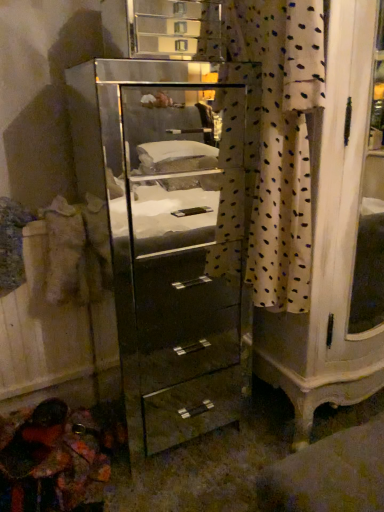
Question: Is mirror-finished glass chest of drawers at center taller or shorter than white dotted fabric at center?

Choices:
 (A) short
 (B) tall

Answer: (B)

Question: Do you think mirror-finished glass chest of drawers at center is within white dotted fabric at center, or outside of it?

Choices:
 (A) outside
 (B) inside

Answer: (A)

Question: Visually, is mirror-finished glass chest of drawers at center positioned to the left or to the right of white dotted fabric at center?

Choices:
 (A) left
 (B) right

Answer: (A)

Question: From a real-world perspective, is white dotted fabric at center physically located above or below mirror-finished glass chest of drawers at center?

Choices:
 (A) below
 (B) above

Answer: (B)

Question: Is white dotted fabric at center in front of or behind mirror-finished glass chest of drawers at center in the image?

Choices:
 (A) behind
 (B) front

Answer: (B)

Question: In terms of height, does white dotted fabric at center look taller or shorter compared to mirror-finished glass chest of drawers at center?

Choices:
 (A) tall
 (B) short

Answer: (B)

Question: Does point (254, 82) appear closer or farther from the camera than point (173, 210)?

Choices:
 (A) closer
 (B) farther

Answer: (A)